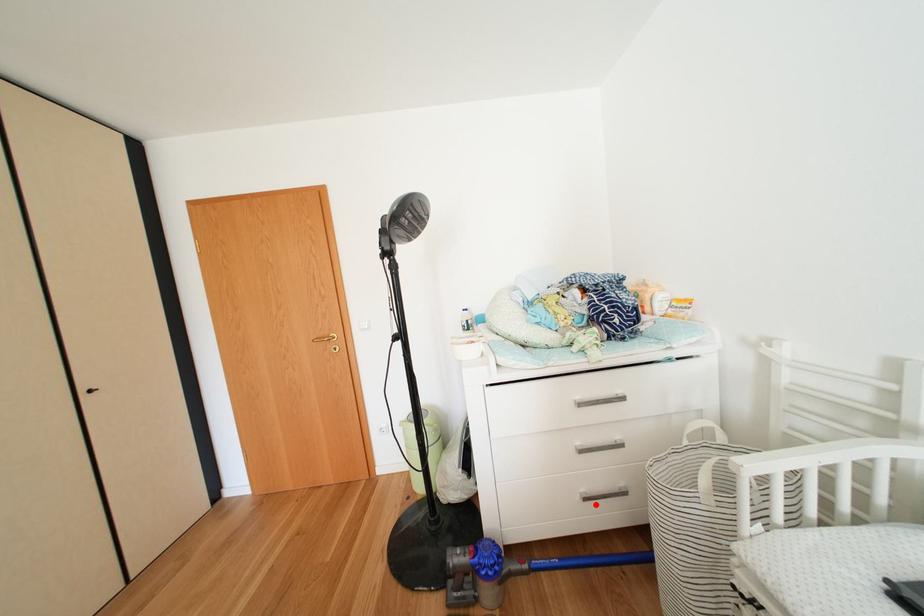
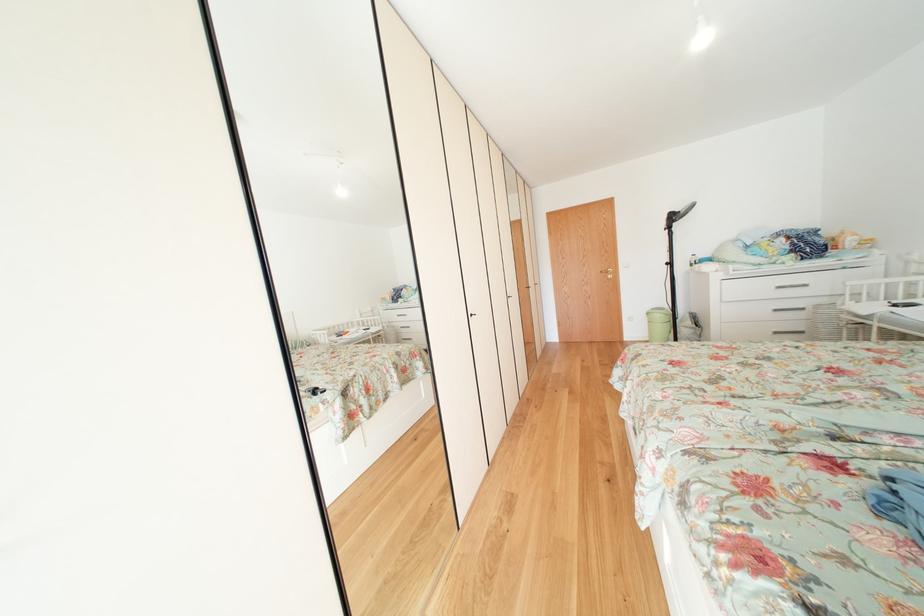
The point at the highlighted location is marked in the first image. Where is the corresponding point in the second image?

(784, 338)